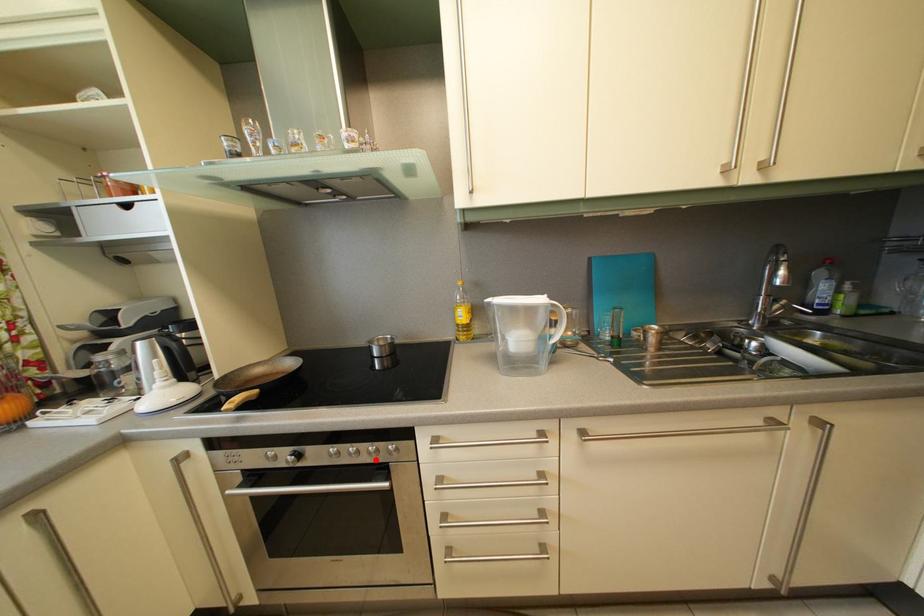
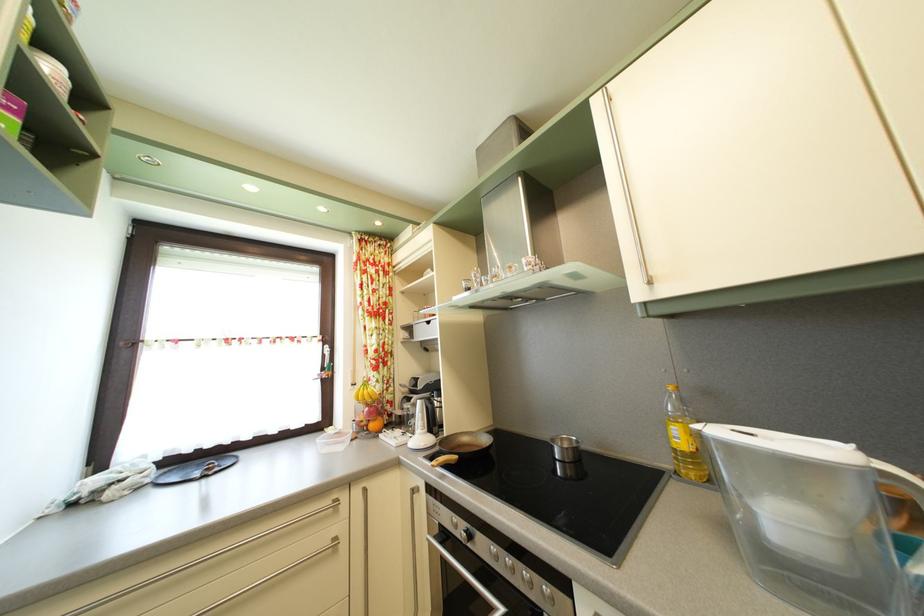
The point at the highlighted location is marked in the first image. Where is the corresponding point in the second image?

(529, 584)